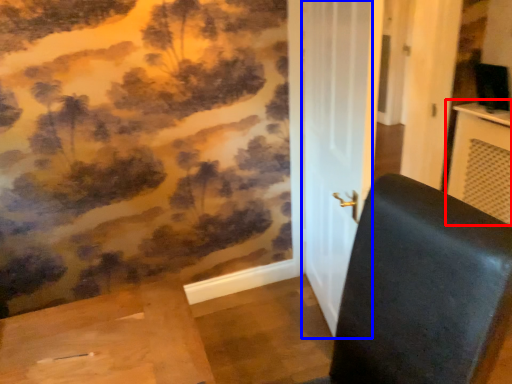
Question: Among these objects, which one is farthest to the camera, table (highlighted by a red box) or screen door (highlighted by a blue box)?

Choices:
 (A) table
 (B) screen door

Answer: (A)